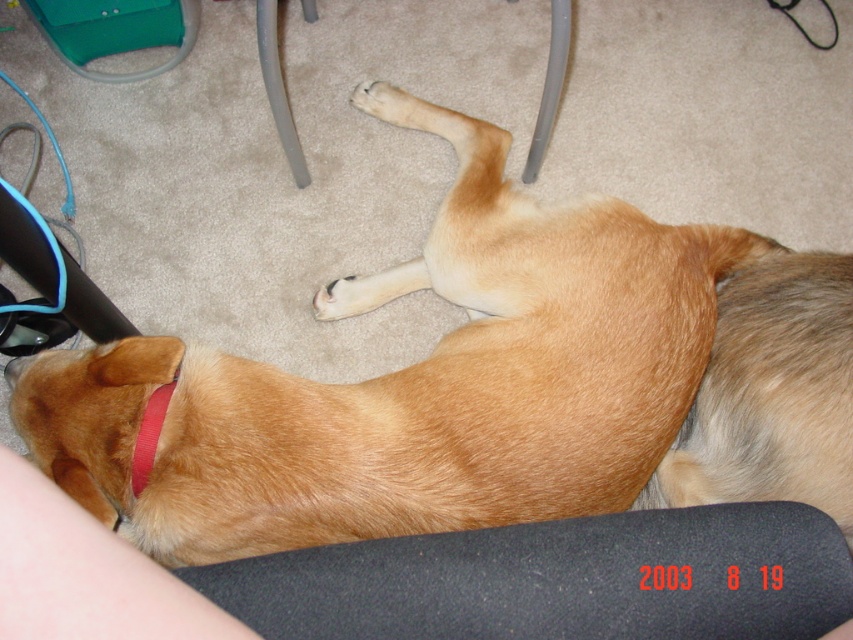
You are a robotic vacuum cleaner trying to move from the left side of the room to the right side. The golden fur dog at lower center is in your path. Based on its 2D coordinates, can you determine if the dog is blocking your path?

The golden fur dog at lower center is located at coordinates (410, 381), which is in the lower center of the room. Since the dog is in the path between the left and right sides, it would block the robotic vacuum cleaner from moving directly across the room unless rerouted around it.

You are a delivery robot entering a room and need to place a package on the black matte mouse pad at lower center. The golden fur dog at lower center is in the way. Can you place the package on the mouse pad without moving the dog?

The black matte mouse pad at lower center is behind the golden fur dog at lower center, so you can place the package on the mouse pad without moving the dog by going around the dog to reach the area behind it.

You are a robotic vacuum cleaner trying to navigate to the golden fur dog at lower center. Your current position is at point 0.5, 0.5. Can you move directly towards the dog without any obstacles in between?

The golden fur dog at lower center is at point (410, 381). Since your current position is at (426, 320), the path between you and the dog is clear as there are no objects listed in the scene description that would block the direct route. Therefore, you can move directly towards the dog.